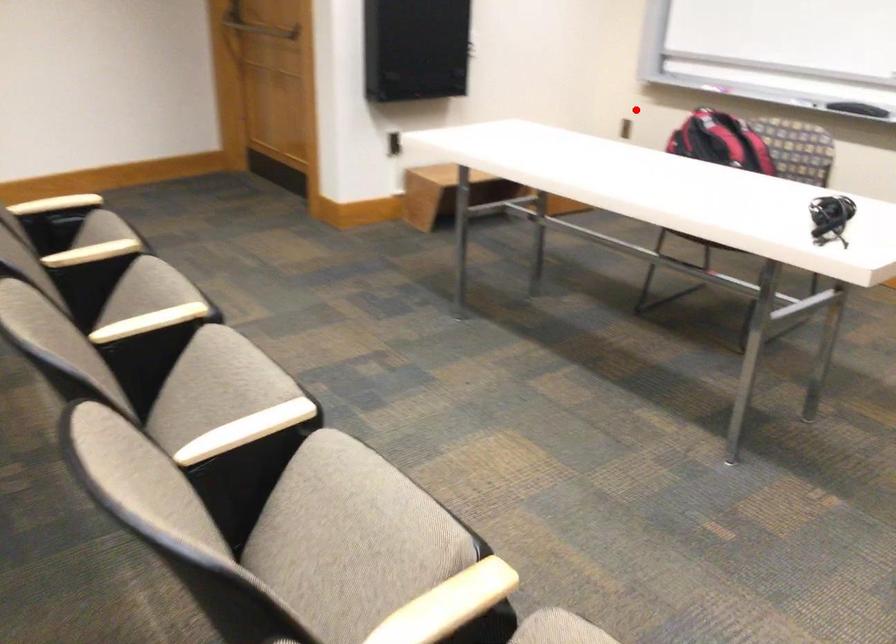
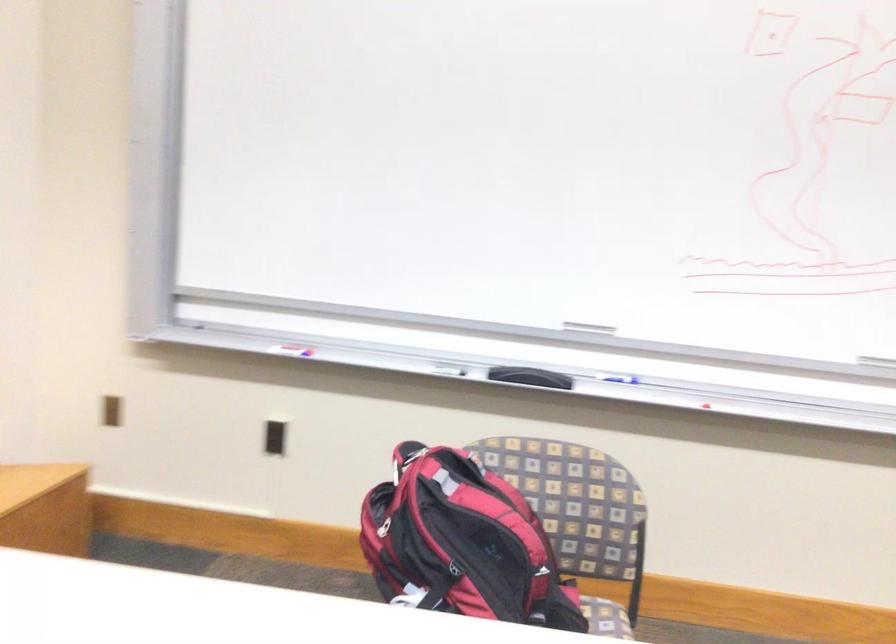
Question: I am providing you with two images of the same scene from different viewpoints. In image1, a red point is highlighted. Considering the same 3D point in image2, which of the following is correct?

Choices:
 (A) It is closer
 (B) It is farther

Answer: (A)